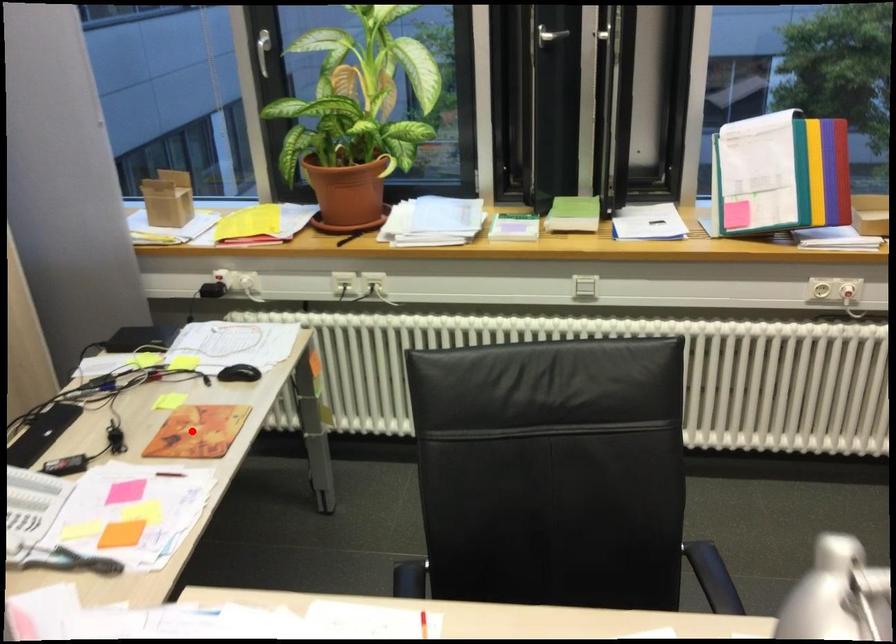
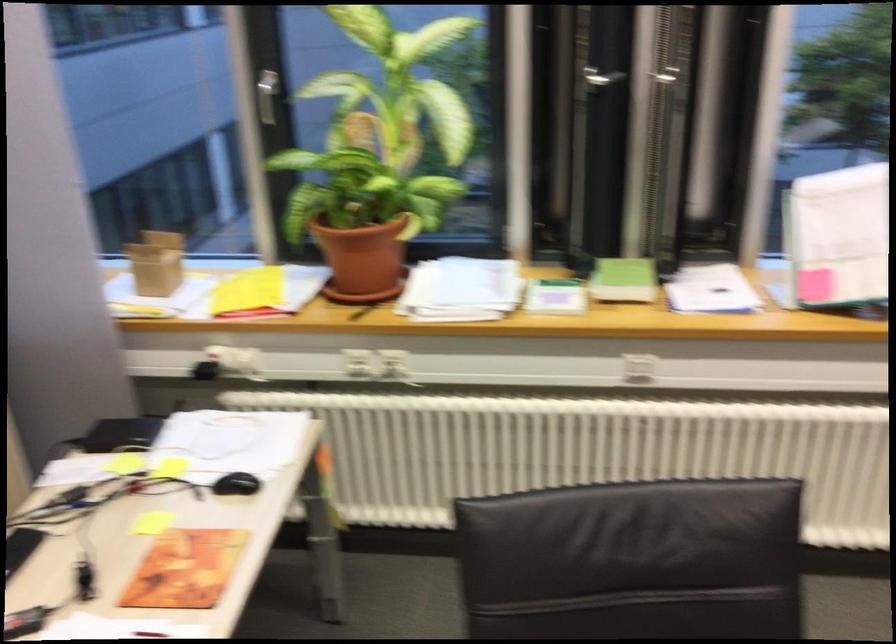
Question: I am providing you with two images of the same scene from different viewpoints. In image1, a red point is highlighted. Considering the same 3D point in image2, which of the following is correct?

Choices:
 (A) It is closer
 (B) It is farther

Answer: (A)